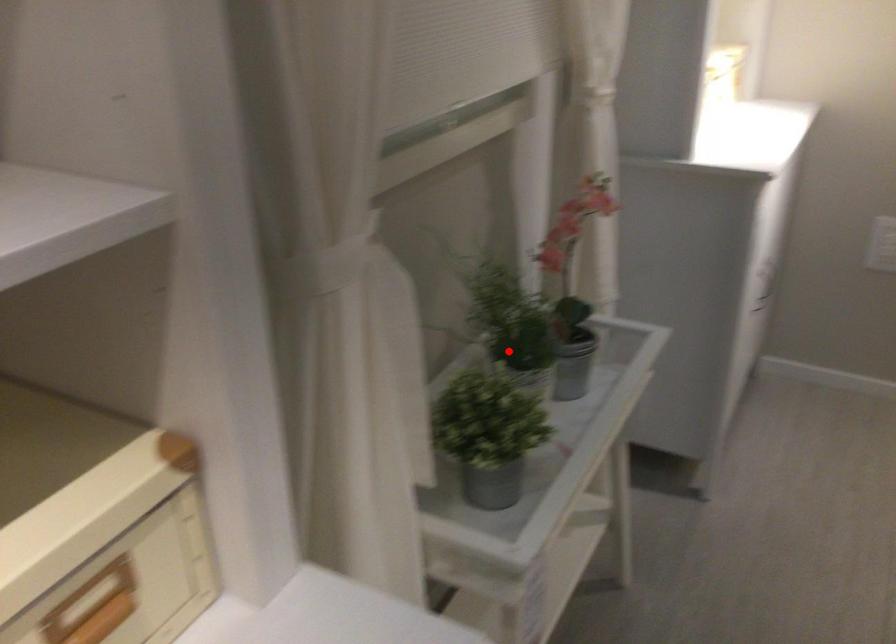
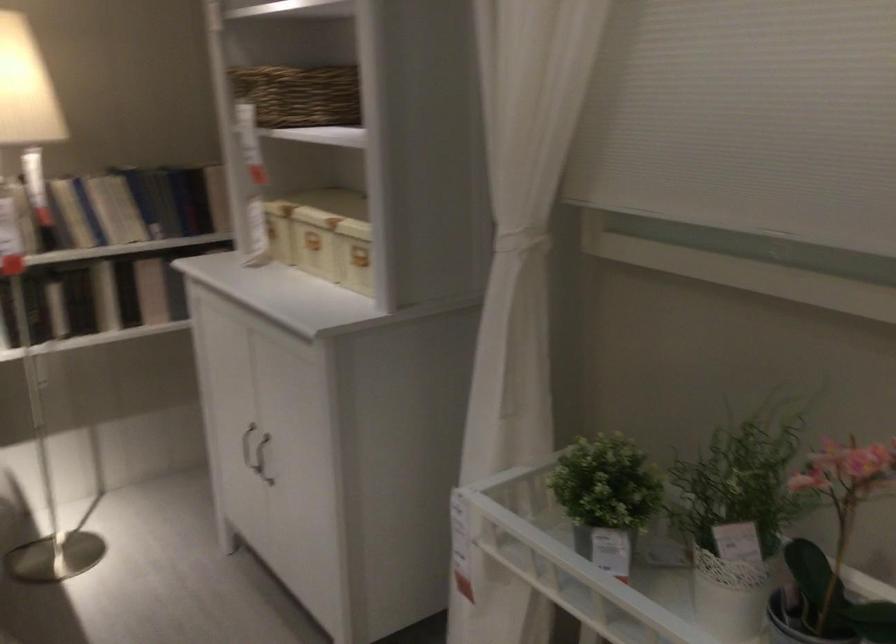
Question: I am providing you with two images of the same scene from different viewpoints. Given a red point in image1, look at the same physical point in image2. Is it:

Choices:
 (A) Closer to the viewpoint
 (B) Farther from the viewpoint

Answer: (A)